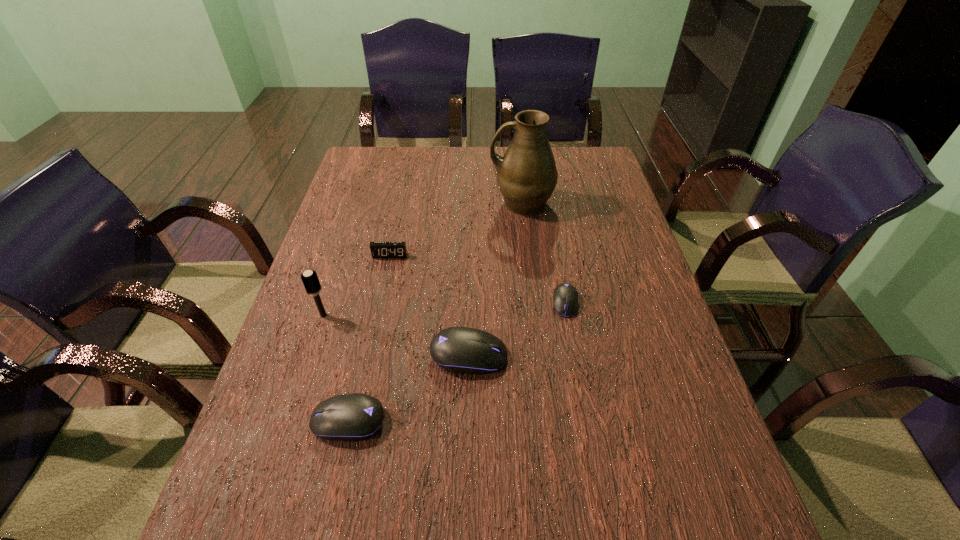
You are a GUI agent. You are given a task and a screenshot of the screen. Output one action in this format:
    pyautogui.click(x=<x>, y=<y>)
    Task: Click on the hairbrush
    
    Given the screenshot: What is the action you would take?
    pyautogui.click(x=309, y=278)

The width and height of the screenshot is (960, 540). I want to click on vacant area situated on the right of the second shortest computer mouse, so click(461, 421).

At what (x,y) coordinates should I click in order to perform the action: click on vacant space located 0.150m on the left of the second computer mouse from left to right. Please return your answer as a coordinate pair (x, y). Looking at the image, I should click on (364, 355).

Where is `vacant position located 0.320m on the left of the shortest computer mouse`? vacant position located 0.320m on the left of the shortest computer mouse is located at coordinates (425, 302).

Locate an element on the screen. Image resolution: width=960 pixels, height=540 pixels. vacant region located on the front-facing side of the alarm clock is located at coordinates (370, 351).

Image resolution: width=960 pixels, height=540 pixels. What are the coordinates of `free location located on the handle side of the farthest object` in the screenshot? It's located at (470, 204).

Find the location of a particular element. The height and width of the screenshot is (540, 960). vacant space located on the handle side of the farthest object is located at coordinates (420, 204).

Where is `vacant space located 0.220m on the handle side of the farthest object`? vacant space located 0.220m on the handle side of the farthest object is located at coordinates (420, 204).

The image size is (960, 540). I want to click on free space located on the front of the hairbrush, so click(270, 478).

This screenshot has height=540, width=960. Identify the location of object present at the near edge. (351, 417).